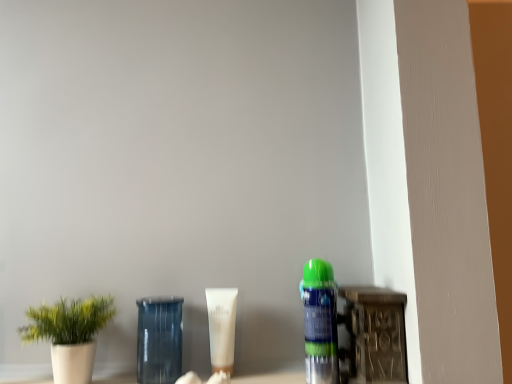
Question: Can you confirm if white matte plant pot at left is smaller than green matte spray can at right?

Choices:
 (A) yes
 (B) no

Answer: (B)

Question: Is white matte plant pot at left thinner than green matte spray can at right?

Choices:
 (A) no
 (B) yes

Answer: (A)

Question: Can you confirm if white matte plant pot at left is taller than green matte spray can at right?

Choices:
 (A) no
 (B) yes

Answer: (A)

Question: Is white matte plant pot at left shorter than green matte spray can at right?

Choices:
 (A) yes
 (B) no

Answer: (A)

Question: Is white matte plant pot at left placed right next to green matte spray can at right?

Choices:
 (A) no
 (B) yes

Answer: (A)

Question: Does white matte plant pot at left come in front of green matte spray can at right?

Choices:
 (A) yes
 (B) no

Answer: (A)

Question: Can you confirm if white matte plant pot at left is positioned to the left of white matte tube at center?

Choices:
 (A) yes
 (B) no

Answer: (A)

Question: Is white matte plant pot at left to the right of white matte tube at center from the viewer's perspective?

Choices:
 (A) yes
 (B) no

Answer: (B)

Question: Does white matte plant pot at left lie behind white matte tube at center?

Choices:
 (A) no
 (B) yes

Answer: (A)

Question: Can you confirm if white matte plant pot at left is shorter than white matte tube at center?

Choices:
 (A) yes
 (B) no

Answer: (B)

Question: Is white matte plant pot at left directly adjacent to white matte tube at center?

Choices:
 (A) no
 (B) yes

Answer: (A)

Question: Is white matte plant pot at left outside of white matte tube at center?

Choices:
 (A) no
 (B) yes

Answer: (B)

Question: Is white matte tube at center to the right of transparent glass jar at center from the viewer's perspective?

Choices:
 (A) no
 (B) yes

Answer: (B)